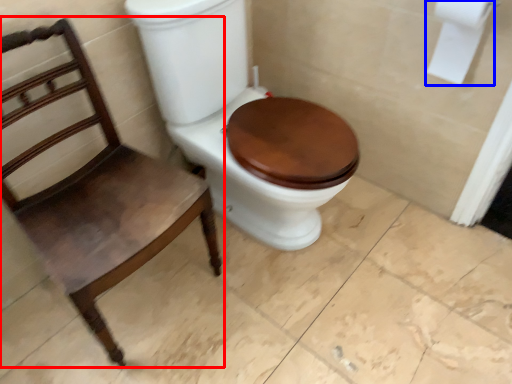
Question: Which point is closer to the camera, chair (highlighted by a red box) or toilet paper (highlighted by a blue box)?

Choices:
 (A) chair
 (B) toilet paper

Answer: (A)